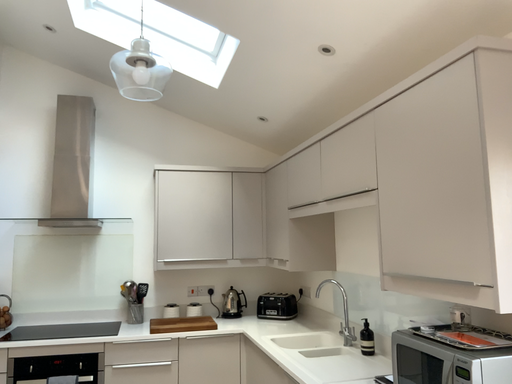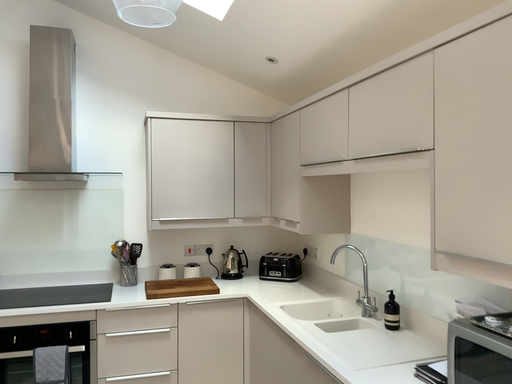
Question: How did the camera likely rotate when shooting the video?

Choices:
 (A) rotated upward
 (B) rotated downward

Answer: (B)